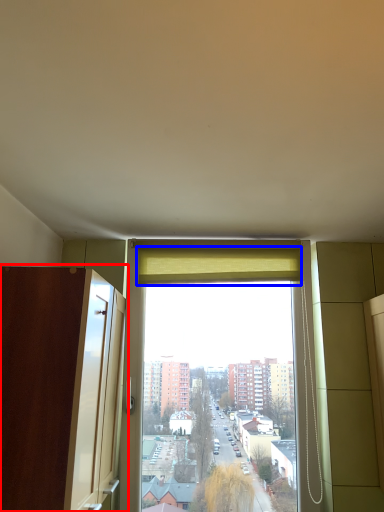
Question: Which object is closer to the camera taking this photo, screen door (highlighted by a red box) or curtain (highlighted by a blue box)?

Choices:
 (A) screen door
 (B) curtain

Answer: (A)